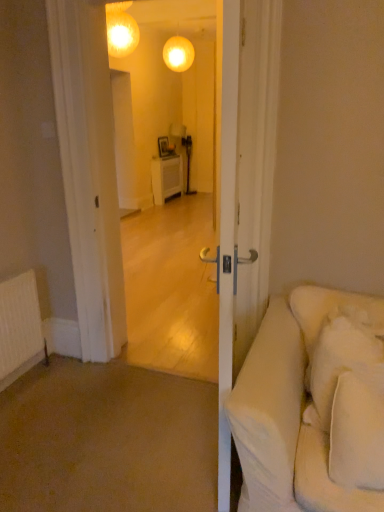
Question: Considering the relative sizes of white soft pillow at right, which is the first pillow from front to back, and white soft pillow at right, which is the 1th pillow from back to front, in the image provided, is white soft pillow at right, which is the first pillow from front to back, bigger than white soft pillow at right, which is the 1th pillow from back to front,?

Choices:
 (A) yes
 (B) no

Answer: (B)

Question: Is white soft pillow at right, the second pillow when ordered from back to front, not inside white soft pillow at right, arranged as the 2th pillow when viewed from the front?

Choices:
 (A) no
 (B) yes

Answer: (B)

Question: Can you confirm if white soft pillow at right, which is the first pillow from front to back, is shorter than white soft pillow at right, which is the 1th pillow from back to front?

Choices:
 (A) no
 (B) yes

Answer: (B)

Question: Does white soft pillow at right, which is the first pillow from front to back, come behind white soft pillow at right, which is the 1th pillow from back to front?

Choices:
 (A) no
 (B) yes

Answer: (A)

Question: Does white soft pillow at right, which is the first pillow from front to back, touch white soft pillow at right, which is the 1th pillow from back to front?

Choices:
 (A) yes
 (B) no

Answer: (B)

Question: In terms of height, does matte glass globe at upper center look taller or shorter compared to white soft pillow at right, which is the first pillow from front to back?

Choices:
 (A) tall
 (B) short

Answer: (B)

Question: Is matte glass globe at upper center inside the boundaries of white soft pillow at right, the second pillow when ordered from back to front, or outside?

Choices:
 (A) inside
 (B) outside

Answer: (B)

Question: Based on their sizes in the image, would you say matte glass globe at upper center is bigger or smaller than white soft pillow at right, which is the first pillow from front to back?

Choices:
 (A) small
 (B) big

Answer: (B)

Question: Is matte glass globe at upper center wider or thinner than white soft pillow at right, the second pillow when ordered from back to front?

Choices:
 (A) wide
 (B) thin

Answer: (A)

Question: Looking at their shapes, would you say white soft pillow at right, arranged as the 2th pillow when viewed from the front, is wider or thinner than white soft pillow at right, which is the first pillow from front to back?

Choices:
 (A) wide
 (B) thin

Answer: (A)

Question: In terms of size, does white soft pillow at right, arranged as the 2th pillow when viewed from the front, appear bigger or smaller than white soft pillow at right, which is the first pillow from front to back?

Choices:
 (A) small
 (B) big

Answer: (B)

Question: From their relative heights in the image, would you say white soft pillow at right, arranged as the 2th pillow when viewed from the front, is taller or shorter than white soft pillow at right, which is the first pillow from front to back?

Choices:
 (A) tall
 (B) short

Answer: (A)

Question: From the image's perspective, is white soft pillow at right, which is the 1th pillow from back to front, above or below white soft pillow at right, the second pillow when ordered from back to front?

Choices:
 (A) above
 (B) below

Answer: (A)

Question: Is white soft pillow at right, the second pillow when ordered from back to front, in front of or behind white soft pillow at right, arranged as the 2th pillow when viewed from the front, in the image?

Choices:
 (A) behind
 (B) front

Answer: (B)

Question: Is white soft pillow at right, the second pillow when ordered from back to front, spatially inside white soft pillow at right, arranged as the 2th pillow when viewed from the front, or outside of it?

Choices:
 (A) outside
 (B) inside

Answer: (A)